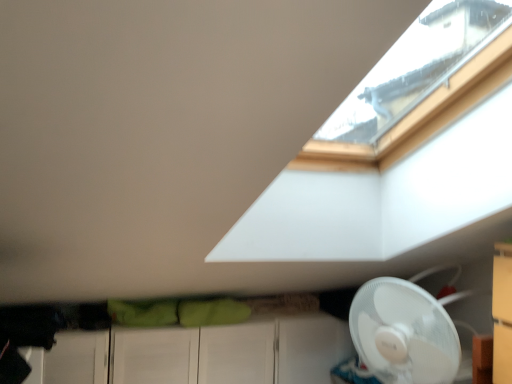
What do you see at coordinates (199, 354) in the screenshot? This screenshot has width=512, height=384. I see `white matte dresser at lower center` at bounding box center [199, 354].

You are a GUI agent. You are given a task and a screenshot of the screen. Output one action in this format:
    pyautogui.click(x=<x>, y=<y>)
    Task: Click on the white matte dresser at lower center
    This screenshot has width=512, height=384.
    Given the screenshot: What is the action you would take?
    pyautogui.click(x=199, y=354)

Identify the location of white matte dresser at lower center. Image resolution: width=512 pixels, height=384 pixels. (199, 354).